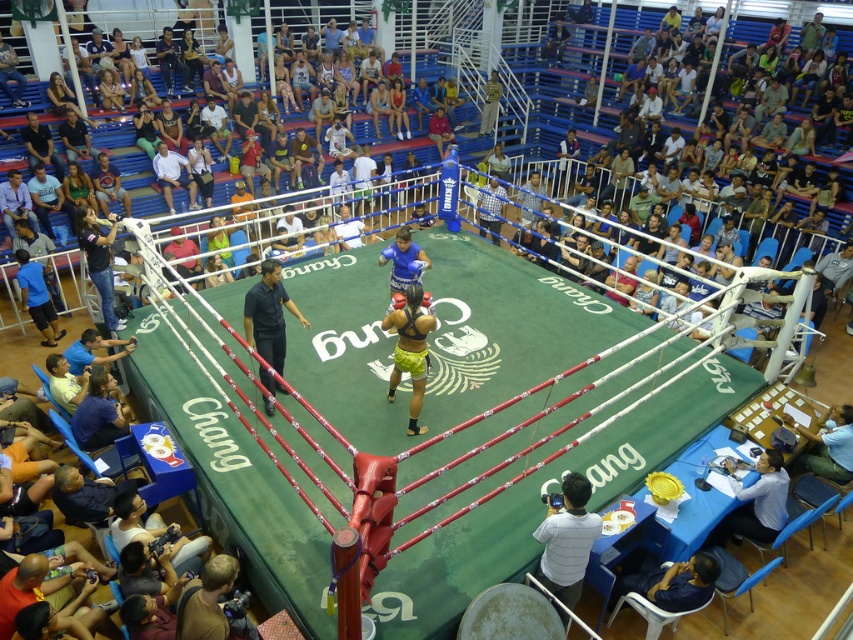
Question: Does black smooth shirt at center have a lesser width compared to yellow fabric shorts at center?

Choices:
 (A) no
 (B) yes

Answer: (A)

Question: In this image, where is white cotton camera at lower center located relative to blue leather gloves at center?

Choices:
 (A) right
 (B) left

Answer: (A)

Question: Is blue leather gloves at center below white cotton shirt at upper left?

Choices:
 (A) yes
 (B) no

Answer: (A)

Question: Considering the real-world distances, which object is farthest from the yellow fabric shorts at center?

Choices:
 (A) white cotton camera at lower center
 (B) white cotton shirt at upper left

Answer: (B)

Question: Which object is positioned farthest from the white cotton camera at lower center?

Choices:
 (A) black smooth shirt at center
 (B) white cotton shirt at upper left
 (C) yellow fabric shorts at center

Answer: (B)

Question: Which object appears closest to the camera in this image?

Choices:
 (A) white cotton shirt at upper left
 (B) black smooth shirt at center
 (C) white cotton camera at lower center

Answer: (C)